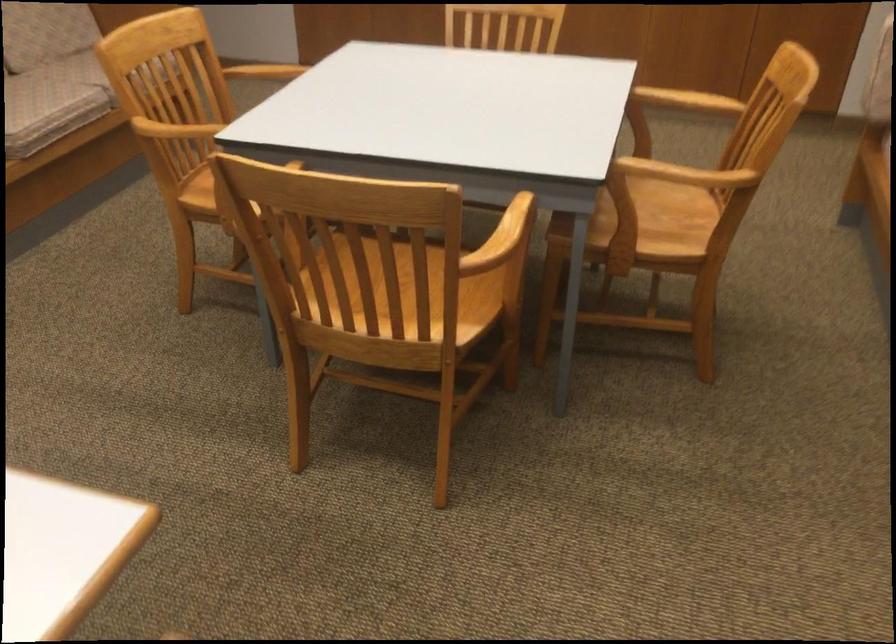
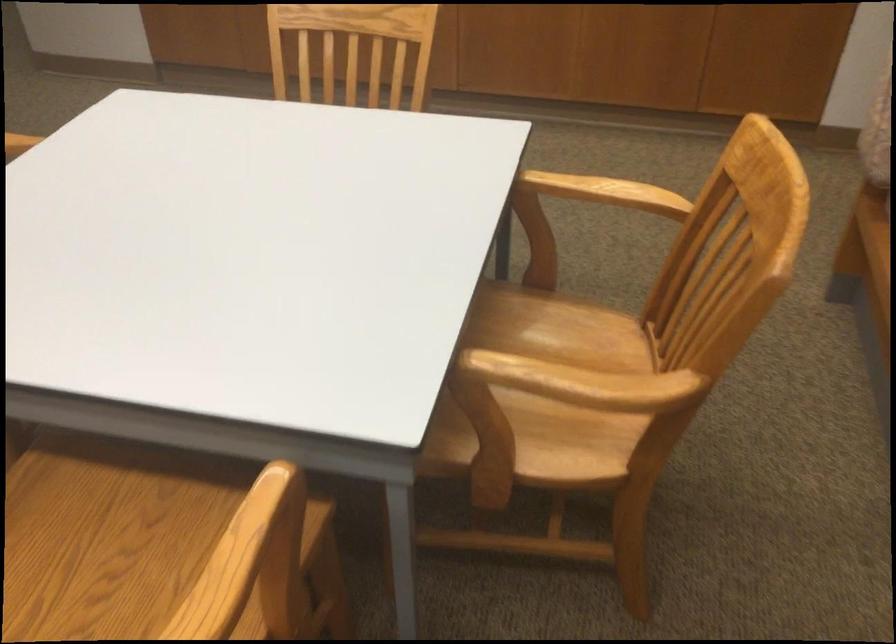
The images are taken continuously from a first-person perspective. In which direction are you moving?

The cameraman walked toward right, forward.